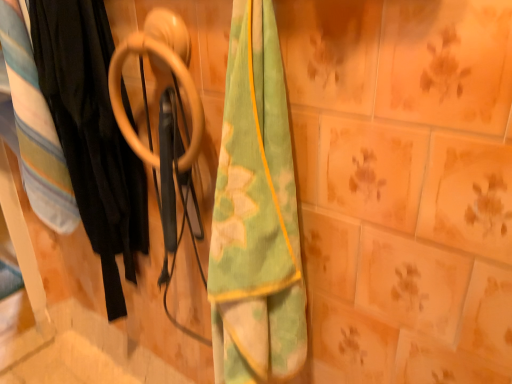
Image resolution: width=512 pixels, height=384 pixels. What do you see at coordinates (92, 134) in the screenshot? I see `black fabric at left` at bounding box center [92, 134].

Find the location of `soft cotton blanket at left`. soft cotton blanket at left is located at coordinates (36, 128).

Where is `black fabric at left`? black fabric at left is located at coordinates (92, 134).

Are wooden ring at center and soft cotton blanket at left beside each other?

No.

From the image's perspective, is wooden ring at center on soft cotton blanket at left?

Yes.

Is soft cotton blanket at left inside wooden ring at center?

No, wooden ring at center does not contain soft cotton blanket at left.

Is point (120, 107) positioned after point (35, 189)?

No.

What are the coordinates of `blanket located on the left of black fabric at left` in the screenshot? It's located at (36, 128).

Is black fabric at left spatially inside soft cotton blanket at left, or outside of it?

black fabric at left exists outside the volume of soft cotton blanket at left.

Is black fabric at left oriented away from soft cotton blanket at left?

black fabric at left does not have its back to soft cotton blanket at left.

From the image's perspective, is black fabric at left on soft cotton blanket at left?

No, from the image's perspective, black fabric at left is not over soft cotton blanket at left.

Find the location of a particular element. towel to the right of wooden ring at center is located at coordinates click(256, 214).

Is point (211, 252) more distant than point (138, 151)?

No.

How many degrees apart are the facing directions of green/yellow fabric towel at center and wooden ring at center?

The angular difference between green/yellow fabric towel at center and wooden ring at center is 7.77 degrees.

Who is smaller, green/yellow fabric towel at center or wooden ring at center?

With smaller size is wooden ring at center.

From the image's perspective, is soft cotton blanket at left positioned above or below wooden ring at center?

Clearly, from the image's perspective, soft cotton blanket at left is below wooden ring at center.

Is soft cotton blanket at left smaller than wooden ring at center?

No, soft cotton blanket at left is not smaller than wooden ring at center.

In the scene shown: Can you tell me how much soft cotton blanket at left and wooden ring at center differ in facing direction?

The angular difference between soft cotton blanket at left and wooden ring at center is 7.77 degrees.

Considering the relative sizes of green/yellow fabric towel at center and black fabric at left in the image provided, is green/yellow fabric towel at center bigger than black fabric at left?

No.

Is black fabric at left surrounded by green/yellow fabric towel at center?

No, black fabric at left is not a part of green/yellow fabric towel at center.

Can you confirm if green/yellow fabric towel at center is thinner than black fabric at left?

Incorrect, the width of green/yellow fabric towel at center is not less than that of black fabric at left.

How different are the orientations of green/yellow fabric towel at center and black fabric at left in degrees?

They differ by 0.00455 degrees in their facing directions.

Locate an element on the screen. door handle behind the green/yellow fabric towel at center is located at coordinates (180, 82).

Does wooden ring at center have a lesser width compared to green/yellow fabric towel at center?

Yes, wooden ring at center is thinner than green/yellow fabric towel at center.

From the image's perspective, between wooden ring at center and green/yellow fabric towel at center, which one is located above?

From the image's view, wooden ring at center is above.

Is green/yellow fabric towel at center completely or partially inside wooden ring at center?

Actually, green/yellow fabric towel at center is outside wooden ring at center.

From the image's perspective, which is below, black fabric at left or wooden ring at center?

black fabric at left appears lower in the image.

From a real-world perspective, is black fabric at left physically above wooden ring at center?

Actually, black fabric at left is physically below wooden ring at center in the real world.

Is black fabric at left aimed at wooden ring at center?

No, black fabric at left is not aimed at wooden ring at center.

Considering the relative positions of black fabric at left and wooden ring at center in the image provided, is black fabric at left to the right of wooden ring at center from the viewer's perspective?

No, black fabric at left is not to the right of wooden ring at center.

Locate an element on the screen. The height and width of the screenshot is (384, 512). door handle on the right of the soft cotton blanket at left is located at coordinates (180, 82).

At what (x,y) coordinates should I click in order to perform the action: click on blanket above the black fabric at left (from the image's perspective). Please return your answer as a coordinate pair (x, y). This screenshot has width=512, height=384. Looking at the image, I should click on (36, 128).

From the image, which object appears to be nearer to black fabric at left, green/yellow fabric towel at center or soft cotton blanket at left?

soft cotton blanket at left is closer to black fabric at left.

Which object lies nearer to the anchor point black fabric at left, wooden ring at center or soft cotton blanket at left?

Among the two, soft cotton blanket at left is located nearer to black fabric at left.

Based on the photo, when comparing their distances from soft cotton blanket at left, does green/yellow fabric towel at center or wooden ring at center seem further?

Based on the image, green/yellow fabric towel at center appears to be further to soft cotton blanket at left.

Based on their spatial positions, is wooden ring at center or green/yellow fabric towel at center further from black fabric at left?

green/yellow fabric towel at center is further to black fabric at left.

Based on their spatial positions, is wooden ring at center or soft cotton blanket at left further from green/yellow fabric towel at center?

soft cotton blanket at left lies further to green/yellow fabric towel at center than the other object.

Estimate the real-world distances between objects in this image. Which object is closer to wooden ring at center, green/yellow fabric towel at center or black fabric at left?

Among the two, black fabric at left is located nearer to wooden ring at center.

From the image, which object appears to be nearer to soft cotton blanket at left, green/yellow fabric towel at center or black fabric at left?

black fabric at left is closer to soft cotton blanket at left.

Considering their positions, is green/yellow fabric towel at center positioned closer to black fabric at left than wooden ring at center?

wooden ring at center is positioned closer to the anchor black fabric at left.

Find the location of `clothing situated between soft cotton blanket at left and green/yellow fabric towel at center from left to right`. clothing situated between soft cotton blanket at left and green/yellow fabric towel at center from left to right is located at coordinates (92, 134).

Where is `door handle located between soft cotton blanket at left and green/yellow fabric towel at center in the left-right direction`? The width and height of the screenshot is (512, 384). door handle located between soft cotton blanket at left and green/yellow fabric towel at center in the left-right direction is located at coordinates (180, 82).

Image resolution: width=512 pixels, height=384 pixels. In order to click on clothing between soft cotton blanket at left and wooden ring at center in the horizontal direction in this screenshot , I will do `click(92, 134)`.

Where is `door handle located between black fabric at left and green/yellow fabric towel at center in the left-right direction`? door handle located between black fabric at left and green/yellow fabric towel at center in the left-right direction is located at coordinates (180, 82).